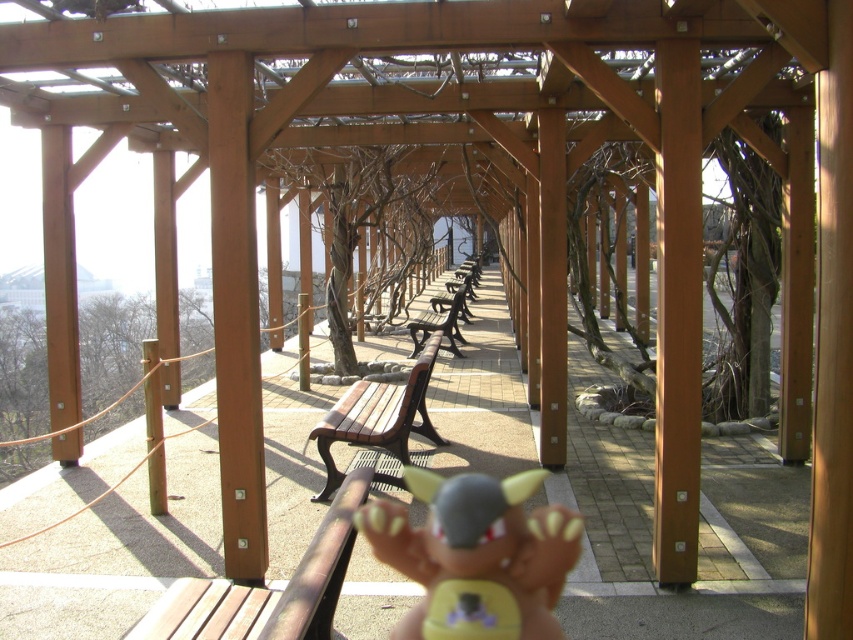
Question: Does brown wooden bench at lower center come in front of brown wooden bench at center?

Choices:
 (A) yes
 (B) no

Answer: (A)

Question: Which point is closer to the camera?

Choices:
 (A) wooden bench at center
 (B) brown wooden bench at center
 (C) matte gray plush toy at center
 (D) brown textured tree at center

Answer: (C)

Question: Which object is the closest to the brown wooden bench at lower center?

Choices:
 (A) matte gray plush toy at center
 (B) brown textured tree at center
 (C) brown wooden bench at center

Answer: (A)

Question: Among these points, which one is farthest from the camera?

Choices:
 (A) (395, 445)
 (B) (364, 164)
 (C) (412, 572)

Answer: (B)

Question: Does wooden bench at center appear on the right side of brown wooden bench at center?

Choices:
 (A) yes
 (B) no

Answer: (B)

Question: Does matte gray plush toy at center appear over brown wooden bench at center?

Choices:
 (A) yes
 (B) no

Answer: (B)